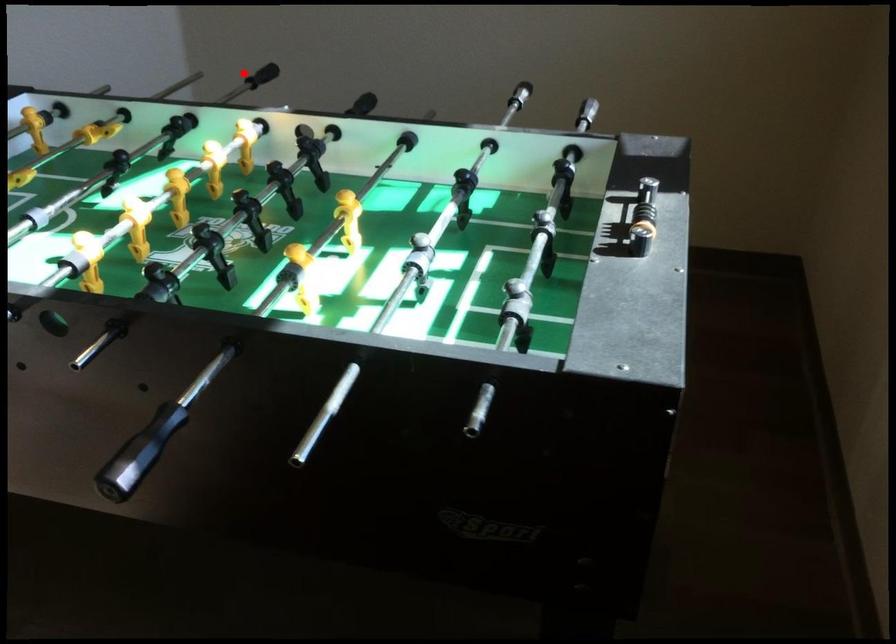
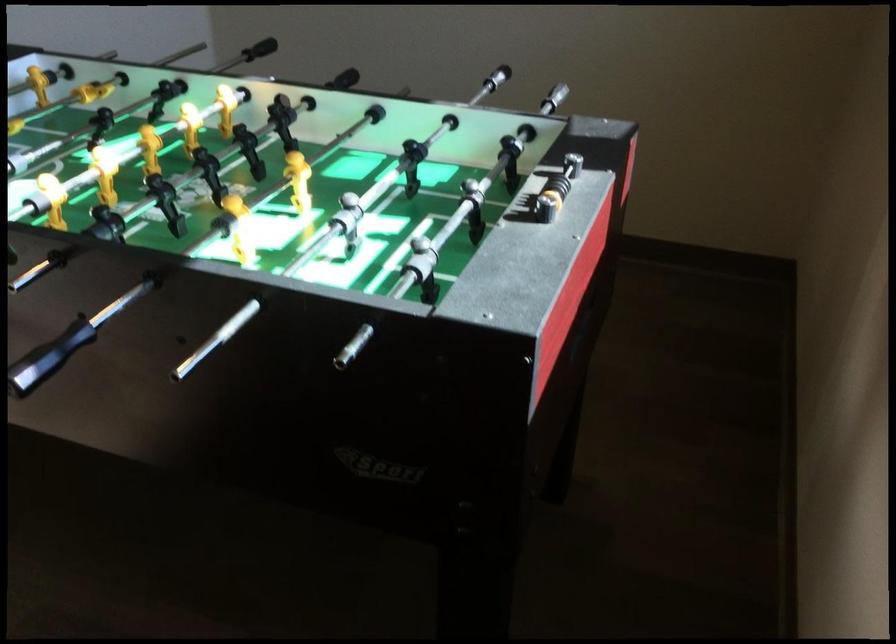
Find the pixel in the second image that matches the highlighted location in the first image.

(259, 49)